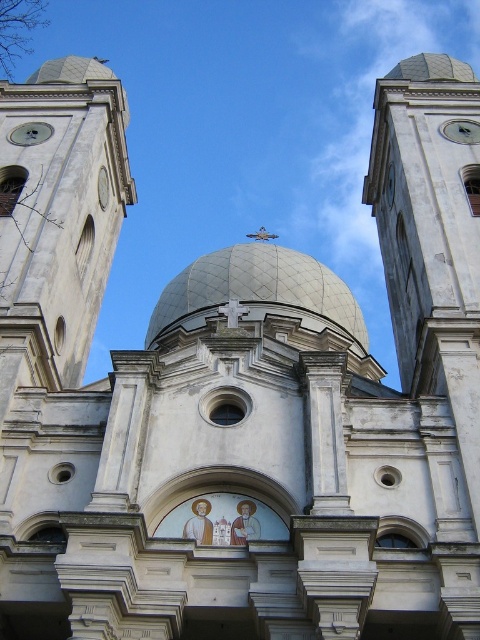
Does white stone tower at upper right have a lesser width compared to metallic clock at upper right?

No.

Who is positioned more to the right, white stone tower at upper right or metallic clock at upper right?

white stone tower at upper right

The image size is (480, 640). Describe the element at coordinates (431, 237) in the screenshot. I see `white stone tower at upper right` at that location.

Find the location of a particular element. This screenshot has width=480, height=640. white stone tower at upper right is located at coordinates (431, 237).

Who is more forward, [431,129] or [195,272]?

Point [431,129]

Between white stone tower at upper right and white textured dome at center, which one appears on the right side from the viewer's perspective?

white stone tower at upper right is more to the right.

Locate an element on the screen. Image resolution: width=480 pixels, height=640 pixels. white stone tower at upper right is located at coordinates (431, 237).

The width and height of the screenshot is (480, 640). In order to click on white stone tower at upper right in this screenshot , I will do `click(431, 237)`.

Who is positioned more to the right, white textured dome at center or metallic clock at upper right?

metallic clock at upper right is more to the right.

Between white textured dome at center and metallic clock at upper right, which one has less height?

Standing shorter between the two is metallic clock at upper right.

Between point (294, 292) and point (458, 120), which one is positioned in front?

Positioned in front is point (458, 120).

Locate an element on the screen. Image resolution: width=480 pixels, height=640 pixels. white textured dome at center is located at coordinates (x=257, y=291).